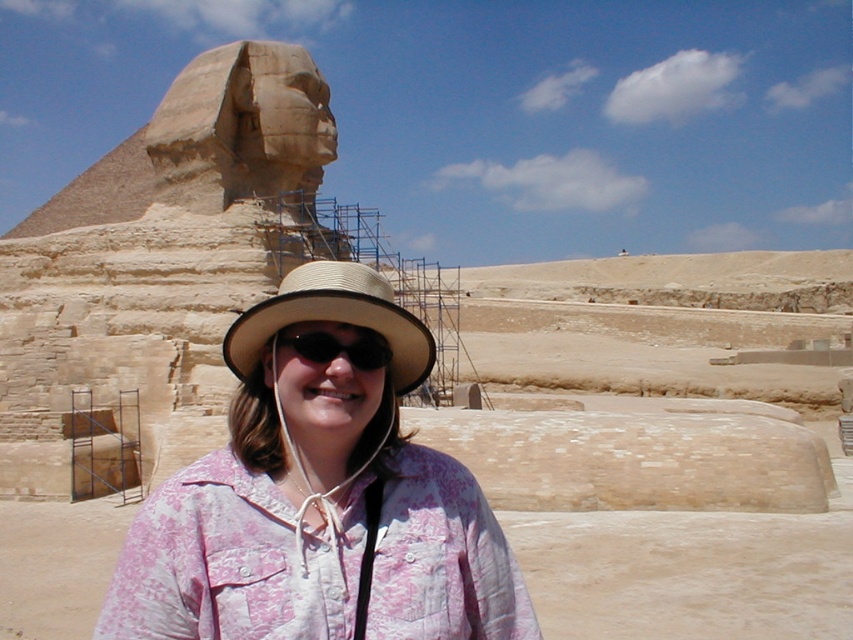
From the picture: You are a tourist visiting the Great Sphinx of Giza and wearing a straw hat at center and black plastic goggles at center. Which item is covering the other?

The straw hat at center is positioned over the black plastic goggles at center, so the hat is covering the goggles.

You are standing at the point closest to the Sphinx. There are two points marked in the scene, one at coordinates point (302, 157) and another at point (364, 333). Which point is farther away from the Sphinx?

Point (302, 157) is behind point (364, 333), so the point farther away from the Sphinx is point (302, 157).

You are standing at the center of the image and want to walk towards the beige stone sphinx at upper left. In which direction should you move?

You should move towards the upper left direction to reach the beige stone sphinx at upper left, as it is located at point (x=209, y=138) in the image.